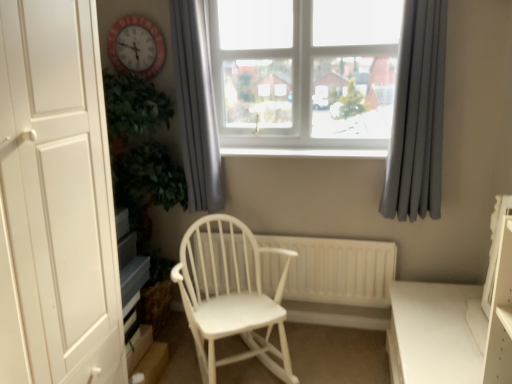
Question: Can you see gray fabric curtain at upper right, arranged as the 2th curtain when viewed from the left, touching white plastic window at upper center?

Choices:
 (A) yes
 (B) no

Answer: (B)

Question: Is white plastic window at upper center at the back of gray fabric curtain at upper right, which is the first curtain from right to left?

Choices:
 (A) no
 (B) yes

Answer: (B)

Question: From a real-world perspective, is gray fabric curtain at upper right, which is the first curtain from right to left, below white plastic window at upper center?

Choices:
 (A) yes
 (B) no

Answer: (A)

Question: Would you say gray fabric curtain at upper right, which is the first curtain from right to left, contains white plastic window at upper center?

Choices:
 (A) yes
 (B) no

Answer: (B)

Question: Could you tell me if gray fabric curtain at upper right, arranged as the 2th curtain when viewed from the left, is facing white plastic window at upper center?

Choices:
 (A) yes
 (B) no

Answer: (B)

Question: From the image's perspective, is white wooden radiator at center above or below gray fabric curtain at upper center, which appears as the first curtain when viewed from the left?

Choices:
 (A) below
 (B) above

Answer: (A)

Question: Is white wooden radiator at center in front of or behind gray fabric curtain at upper center, marked as the second curtain in a right-to-left arrangement, in the image?

Choices:
 (A) front
 (B) behind

Answer: (B)

Question: In terms of height, does white wooden radiator at center look taller or shorter compared to gray fabric curtain at upper center, marked as the second curtain in a right-to-left arrangement?

Choices:
 (A) short
 (B) tall

Answer: (A)

Question: Looking at the image, does white wooden radiator at center seem bigger or smaller compared to gray fabric curtain at upper center, which appears as the first curtain when viewed from the left?

Choices:
 (A) small
 (B) big

Answer: (B)

Question: Is point (354, 61) closer or farther from the camera than point (60, 203)?

Choices:
 (A) farther
 (B) closer

Answer: (A)

Question: Is white plastic window at upper center wider or thinner than white matte door at left?

Choices:
 (A) thin
 (B) wide

Answer: (A)

Question: From the image's perspective, is white plastic window at upper center positioned above or below white matte door at left?

Choices:
 (A) above
 (B) below

Answer: (A)

Question: Is white plastic window at upper center to the left or to the right of white matte door at left in the image?

Choices:
 (A) left
 (B) right

Answer: (B)

Question: From their relative heights in the image, would you say white wooden radiator at center is taller or shorter than white matte door at left?

Choices:
 (A) short
 (B) tall

Answer: (A)

Question: Is white wooden radiator at center wider or thinner than white matte door at left?

Choices:
 (A) thin
 (B) wide

Answer: (A)